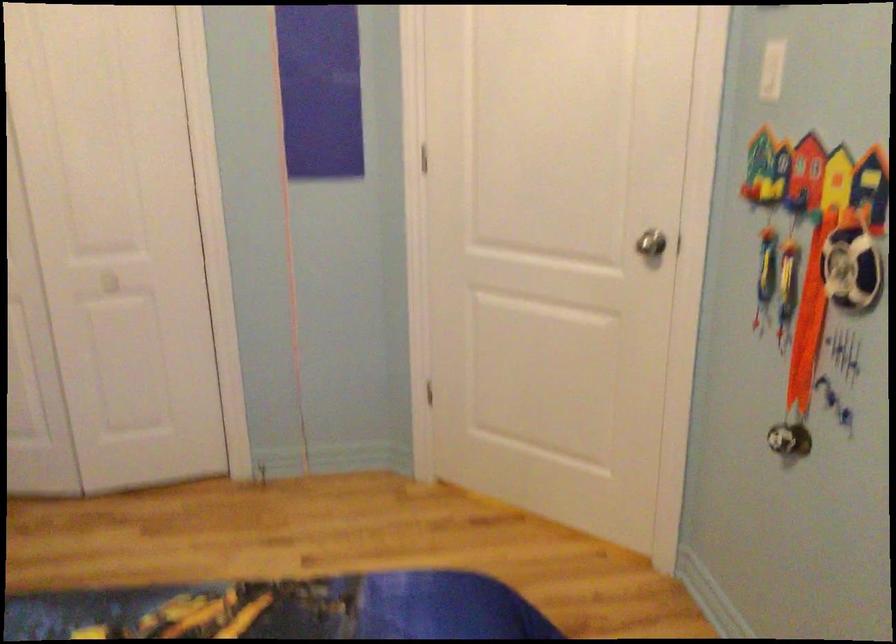
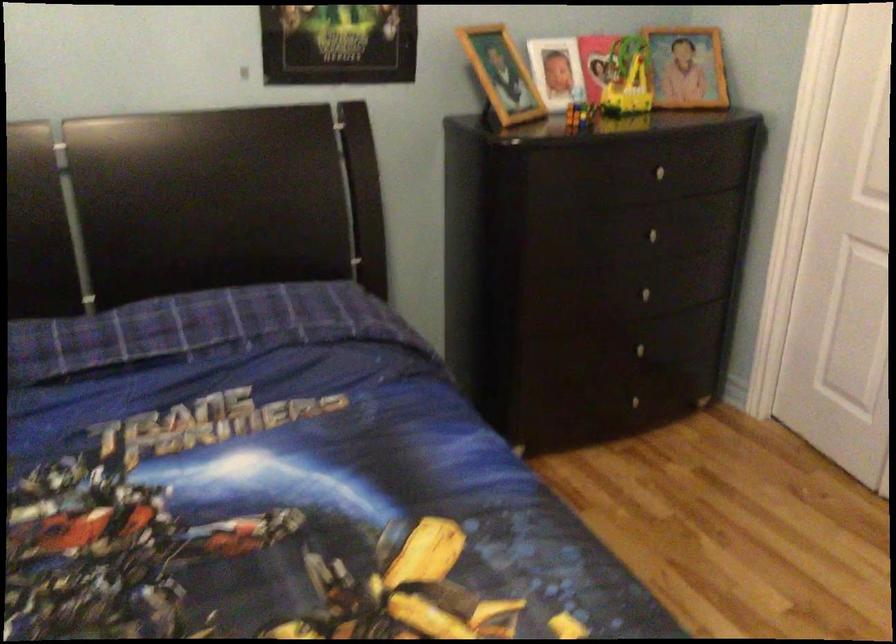
How did the camera likely rotate?

The camera rotated toward left-down.